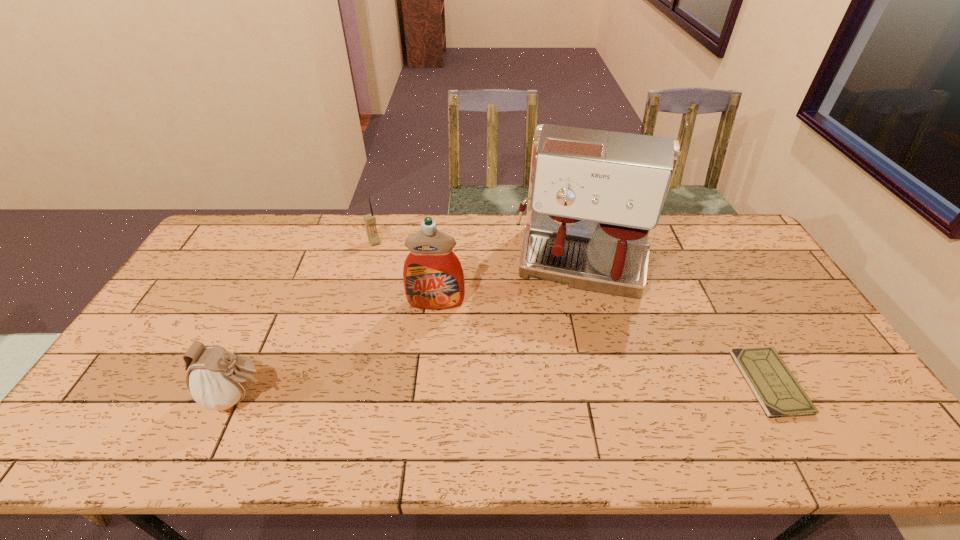
I want to click on vacant space at the near left corner of the desktop, so click(104, 395).

In the image, there is a desktop. Where is `free region at the near right corner`? The width and height of the screenshot is (960, 540). free region at the near right corner is located at coordinates (806, 390).

I want to click on empty space that is in between the coffee maker and the fourth object from right to left, so click(479, 252).

I want to click on unoccupied area between the leftmost object and the cellular telephone, so click(306, 319).

Locate an element on the screen. free space between the leftmost object and the shortest object is located at coordinates (x=504, y=389).

Image resolution: width=960 pixels, height=540 pixels. In order to click on free space between the shortest object and the second tallest object in this screenshot , I will do `click(603, 342)`.

Locate an element on the screen. vacant region between the second object from left to right and the leftmost object is located at coordinates (306, 319).

Identify the location of empty space between the second object from right to left and the pouch. The image size is (960, 540). click(x=412, y=329).

Image resolution: width=960 pixels, height=540 pixels. I want to click on vacant space that's between the pouch and the tallest object, so click(x=412, y=329).

The height and width of the screenshot is (540, 960). Identify the location of free space between the rightmost object and the third object from left to right. (603, 342).